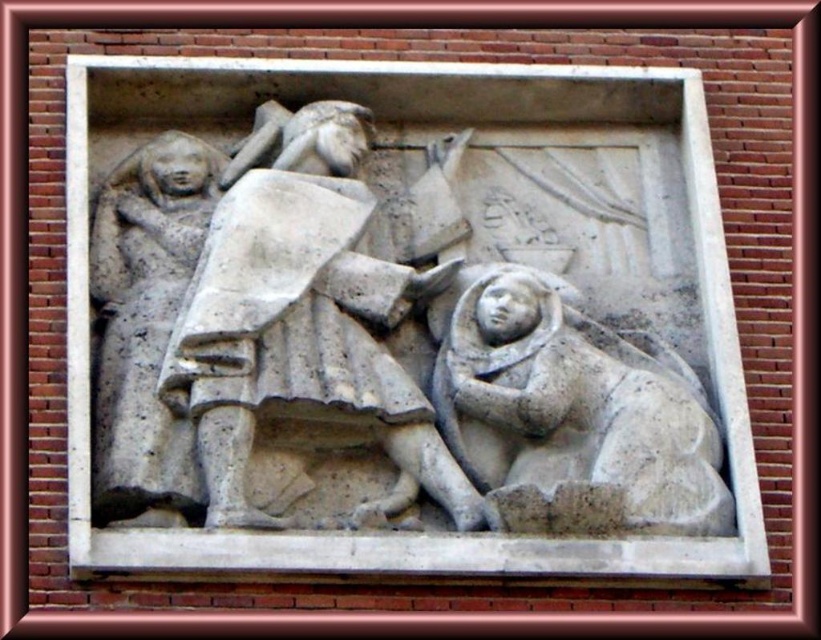
Based on the scene described, which object is wider, the white stone figure at center or the gray stone figure at lower right?

The white stone figure at center is wider than the gray stone figure at lower right according to the description.